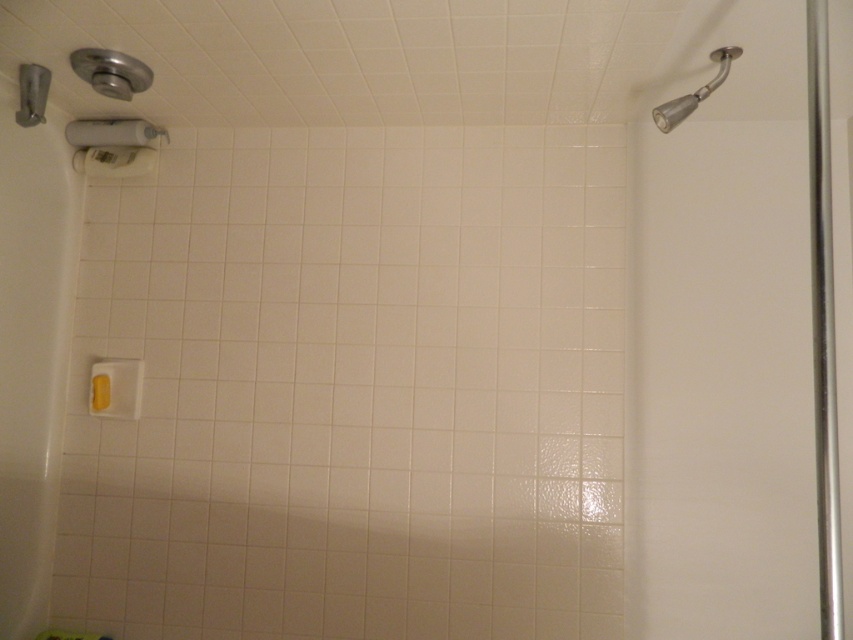
Question: Which object appears closest to the camera in this image?

Choices:
 (A) matte gray showerhead at upper left
 (B) satin nickel showerhead at upper right

Answer: (B)

Question: Which object appears farthest from the camera in this image?

Choices:
 (A) matte gray showerhead at upper left
 (B) satin nickel showerhead at upper right

Answer: (A)

Question: Does silver metallic shower door at right have a smaller size compared to matte gray showerhead at upper left?

Choices:
 (A) no
 (B) yes

Answer: (A)

Question: Does silver metallic shower door at right appear over matte gray showerhead at upper left?

Choices:
 (A) yes
 (B) no

Answer: (B)

Question: Which point appears closest to the camera in this image?

Choices:
 (A) (685, 113)
 (B) (740, 285)

Answer: (A)

Question: Is satin nickel showerhead at upper right thinner than matte gray showerhead at upper left?

Choices:
 (A) yes
 (B) no

Answer: (B)